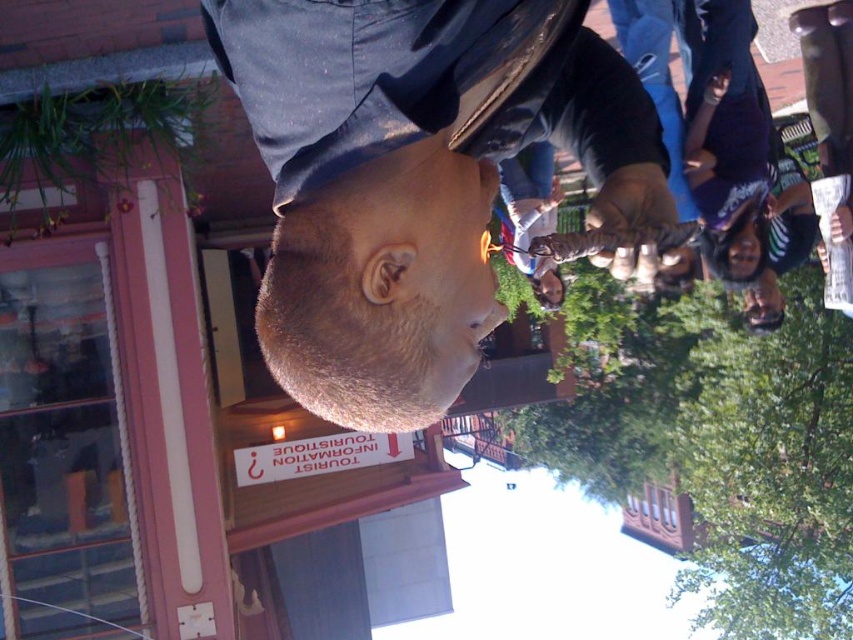
You are a photographer trying to capture a clear shot of both the smooth skin head at center and the matte black head at lower right. Based on their positions, which one might be easier to focus on and why?

The smooth skin head at center is easier to focus on because it is positioned in front of the matte black head at lower right, making it closer to the camera and thus more in focus.

Based on the photo, you are a photographer trying to capture a portrait of the smooth skin head at center. Your camera has a minimum focusing distance of 4 feet. Can you take a clear photo without moving closer?

The smooth skin head at center and camera are 4.35 feet apart. Since the minimum focusing distance is 4 feet, the camera can focus and take a clear photo as the distance is sufficient.